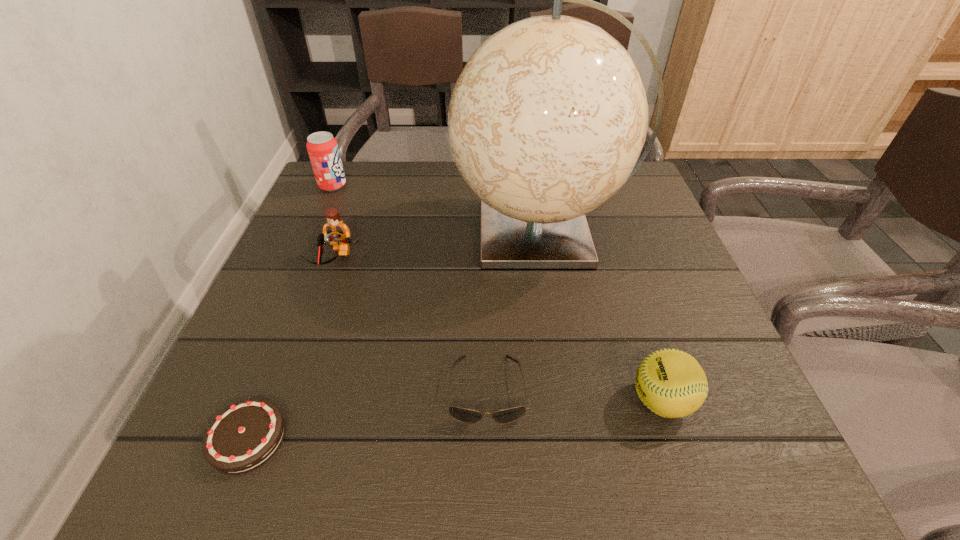
Locate an element on the screen. vacant space located 0.310m holding a crossbow in the hands of the Lego is located at coordinates (280, 414).

This screenshot has width=960, height=540. Identify the location of free space located 0.340m on the logo side of the softball. (415, 401).

You are a GUI agent. You are given a task and a screenshot of the screen. Output one action in this format:
    pyautogui.click(x=<x>, y=<y>)
    Task: Click on the free space located 0.050m on the logo side of the softball
    The width and height of the screenshot is (960, 540).
    Given the screenshot: What is the action you would take?
    pyautogui.click(x=598, y=401)

In order to click on free space located 0.330m on the logo side of the softball in this screenshot , I will do `click(421, 401)`.

I want to click on free space located on the front-facing side of the sunglasses, so click(x=488, y=461).

The height and width of the screenshot is (540, 960). What are the coordinates of `free space located 0.290m on the back of the chocolate cake` in the screenshot? It's located at (313, 275).

Image resolution: width=960 pixels, height=540 pixels. Identify the location of globe present at the far edge. (546, 122).

Locate an element on the screen. The width and height of the screenshot is (960, 540). soda can at the far edge is located at coordinates (322, 147).

Identify the location of softball situated at the near edge. (671, 383).

At what (x,y) coordinates should I click in order to perform the action: click on sunglasses present at the near edge. Please return your answer as a coordinate pair (x, y). Looking at the image, I should click on (469, 416).